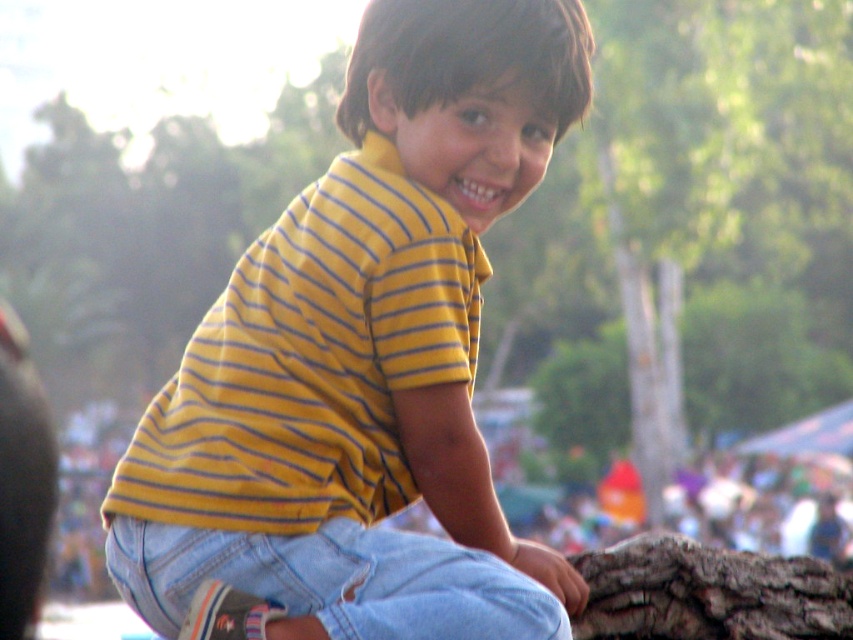
Does yellow striped shirt at center have a greater height compared to brown rough log at lower right?

Yes, yellow striped shirt at center is taller than brown rough log at lower right.

Find the location of a particular element. Image resolution: width=853 pixels, height=640 pixels. yellow striped shirt at center is located at coordinates (363, 364).

Who is more forward, (515, 48) or (108, 536)?

Positioned in front is point (515, 48).

Does yellow striped shirt at center have a greater height compared to denim jeans at lower center?

Indeed, yellow striped shirt at center has a greater height compared to denim jeans at lower center.

In order to click on yellow striped shirt at center in this screenshot , I will do `click(363, 364)`.

At what (x,y) coordinates should I click in order to perform the action: click on yellow striped shirt at center. Please return your answer as a coordinate pair (x, y). Image resolution: width=853 pixels, height=640 pixels. Looking at the image, I should click on (363, 364).

Which is above, denim jeans at lower center or brown rough log at lower right?

Positioned higher is denim jeans at lower center.

Is denim jeans at lower center wider than brown rough log at lower right?

Indeed, denim jeans at lower center has a greater width compared to brown rough log at lower right.

Does point (393, 563) come closer to viewer compared to point (732, 589)?

Yes, it is in front of point (732, 589).

The width and height of the screenshot is (853, 640). Find the location of `denim jeans at lower center`. denim jeans at lower center is located at coordinates (334, 580).